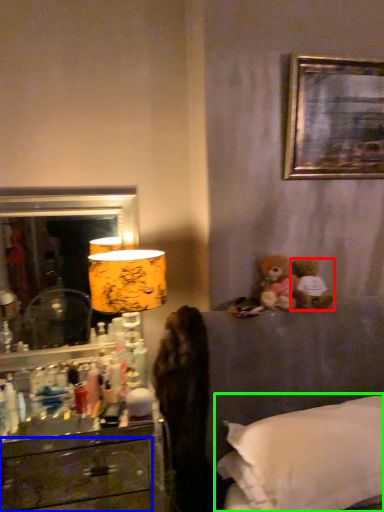
Question: Which object is the farthest from teddy bear (highlighted by a red box)? Choose among these: drawer (highlighted by a blue box) or bed (highlighted by a green box).

Choices:
 (A) drawer
 (B) bed

Answer: (A)